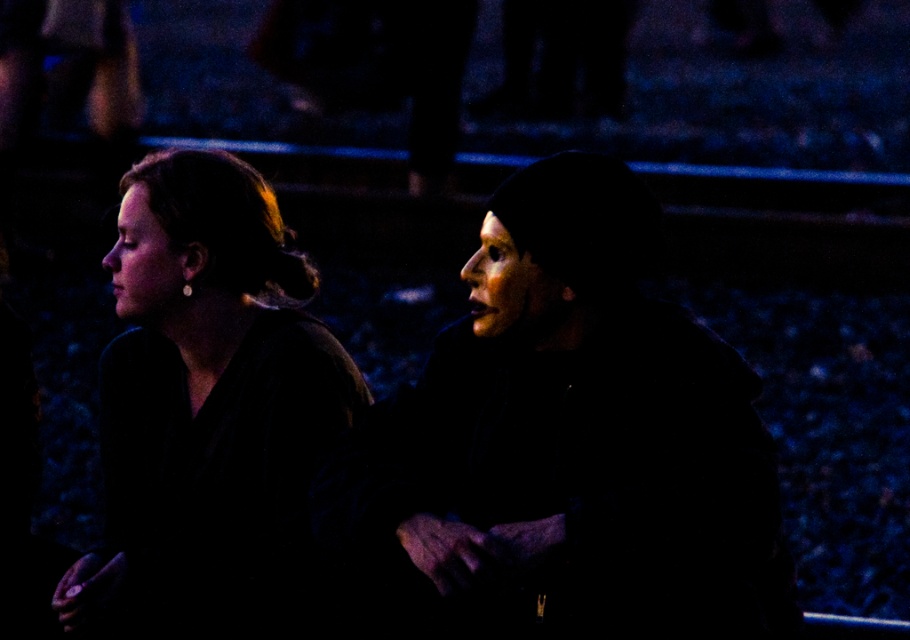
You are a fashion designer observing two coats in an image. The black matte coat at center and the matte brown coat at left. Which coat is positioned lower in the image?

The black matte coat at center is positioned lower than the matte brown coat at left.

You are a photographer trying to capture a candid shot of the two people in the image. You need to ensure that both the black matte coat at center and the matte brown coat at left are fully visible in the frame. Given their sizes, will you need to adjust the camera angle to accommodate their sizes?

The black matte coat at center occupies less space than the matte brown coat at left, so you will need to adjust the camera angle to ensure the larger matte brown coat at left fits entirely within the frame.

You are a fashion designer observing two coats in an image. You need to determine which coat is shorter between the black matte coat at center and the matte brown coat at left. Which one is shorter?

The black matte coat at center is shorter than the matte brown coat at left according to the description.